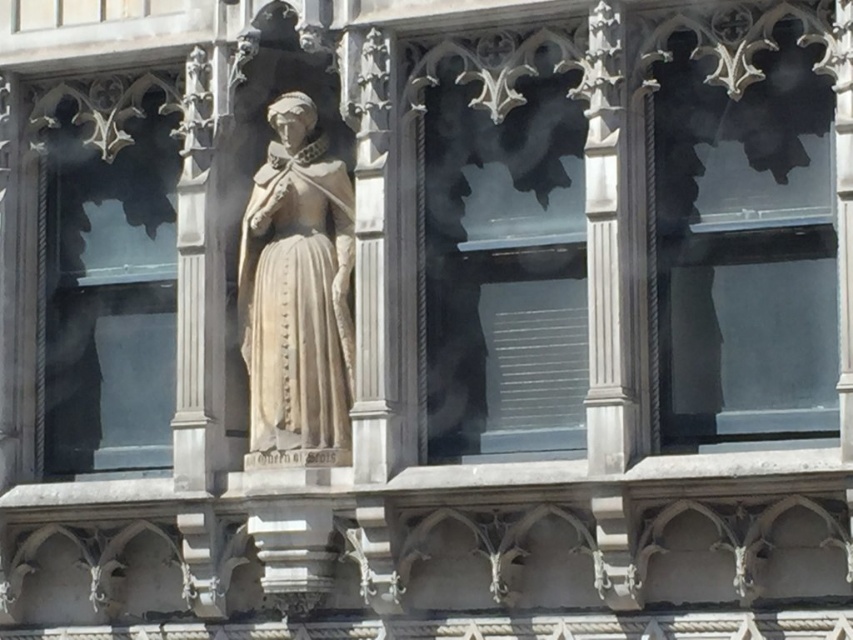
Question: Is transparent glass window at upper center behind transparent glass window at left?

Choices:
 (A) no
 (B) yes

Answer: (A)

Question: Is transparent glass window at upper center below clear glass window at center?

Choices:
 (A) no
 (B) yes

Answer: (A)

Question: Which object is positioned farthest from the transparent glass window at left?

Choices:
 (A) clear glass window at center
 (B) white stone statue at center

Answer: (A)

Question: Which object is farther from the camera taking this photo?

Choices:
 (A) transparent glass window at upper center
 (B) clear glass window at center
 (C) white stone statue at center

Answer: (C)

Question: Considering the relative positions of clear glass window at center and transparent glass window at left in the image provided, where is clear glass window at center located with respect to transparent glass window at left?

Choices:
 (A) above
 (B) below

Answer: (A)

Question: Which point is farther from the camera taking this photo?

Choices:
 (A) (790, 36)
 (B) (314, 404)

Answer: (B)